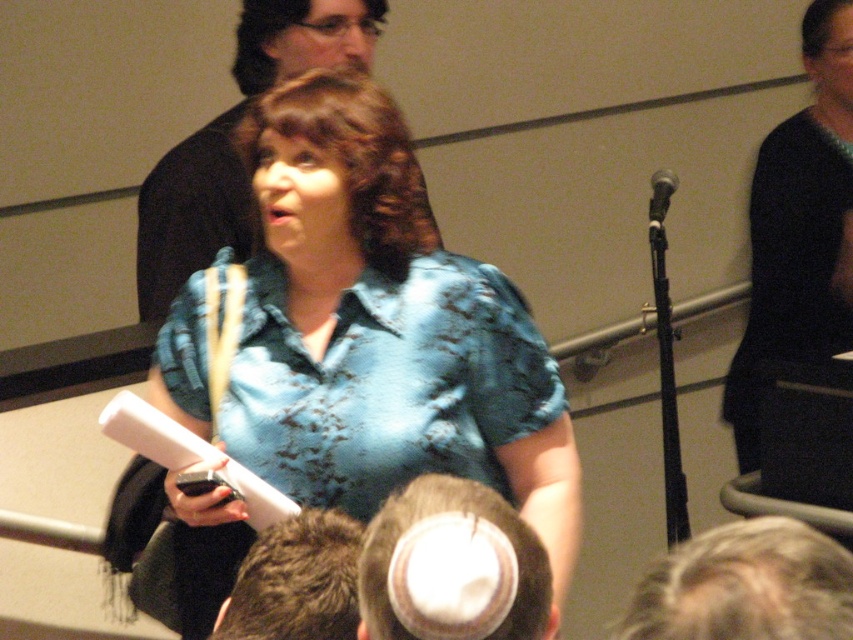
Question: Where is gray matte hair at upper center located in relation to brownshinyhair at center in the image?

Choices:
 (A) below
 (B) above

Answer: (A)

Question: Which of the following is the farthest from the observer?

Choices:
 (A) blue silk blouse at center
 (B) brown fuzzy hair at lower center
 (C) black fabric at right
 (D) dark brown hair at lower center

Answer: (C)

Question: Does blue silk blouse at center lie behind brown fuzzy hair at lower center?

Choices:
 (A) no
 (B) yes

Answer: (B)

Question: Which of the following is the closest to the observer?

Choices:
 (A) black textured shirt at upper center
 (B) dark brown hair at lower center
 (C) gray matte hair at upper center

Answer: (C)

Question: Does gray matte hair at upper center appear under brown fuzzy hair at lower center?

Choices:
 (A) yes
 (B) no

Answer: (B)

Question: Which point is closer to the camera?

Choices:
 (A) (804, 554)
 (B) (659, 172)

Answer: (A)